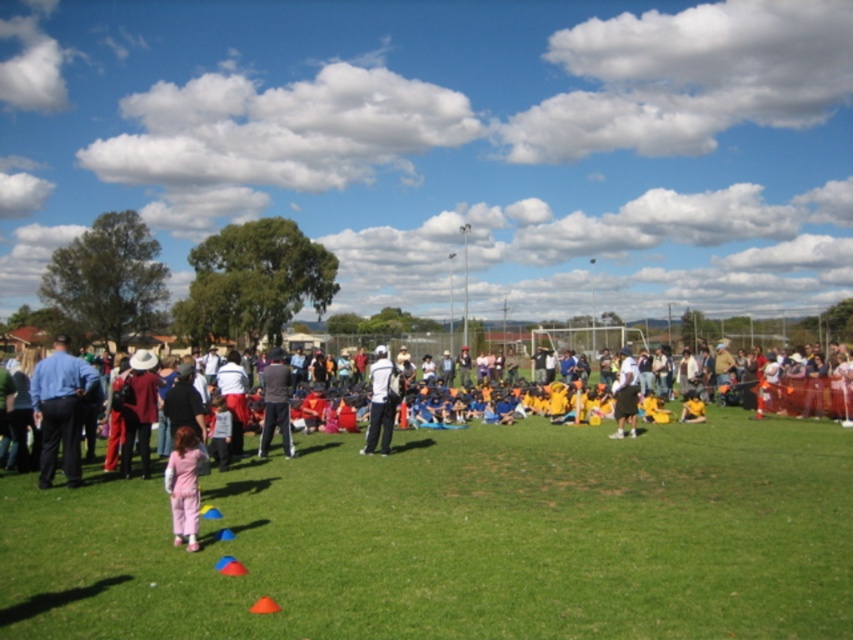
Question: Which point is farther from the camera taking this photo?

Choices:
 (A) (281, 397)
 (B) (49, 433)
 (C) (378, 417)

Answer: (C)

Question: Considering the relative positions of pink fabric pants at lower left and blue shirt at left in the image provided, where is pink fabric pants at lower left located with respect to blue shirt at left?

Choices:
 (A) right
 (B) left

Answer: (A)

Question: Which object appears closest to the camera in this image?

Choices:
 (A) white matte shirt at center
 (B) dark gray pants at center

Answer: (B)

Question: Is pink fabric pants at lower left below blue shirt at left?

Choices:
 (A) yes
 (B) no

Answer: (A)

Question: In this image, where is green grass at center located relative to white matte shirt at center?

Choices:
 (A) left
 (B) right

Answer: (B)

Question: Which object is the closest to the blue shirt at left?

Choices:
 (A) green grass at center
 (B) pink fabric pants at lower left

Answer: (A)